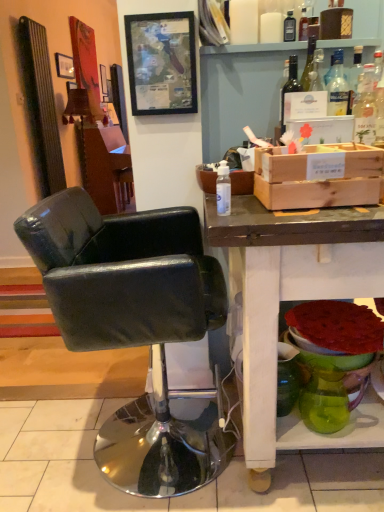
Locate an element on the screen. This screenshot has height=512, width=384. free space to the left of black leather chair at center is located at coordinates (41, 435).